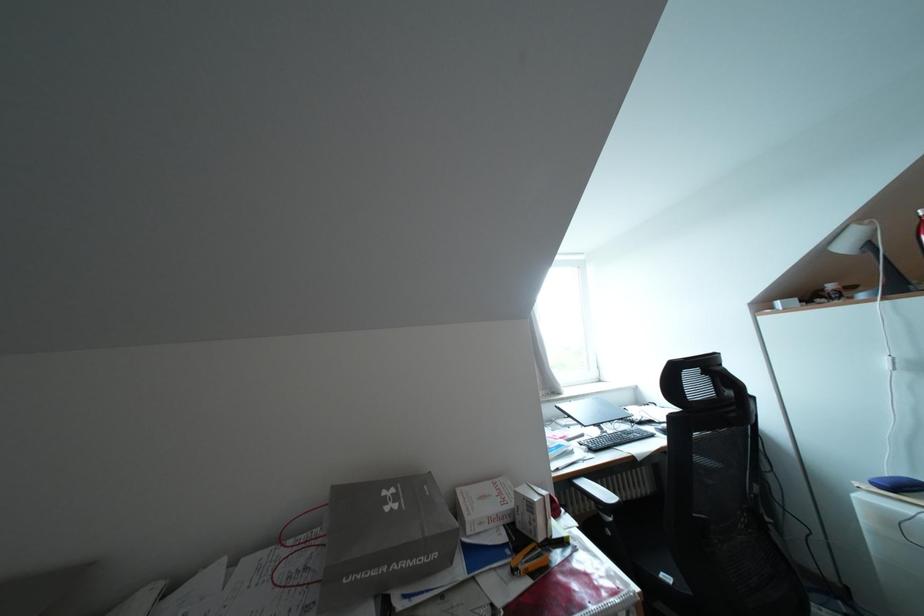
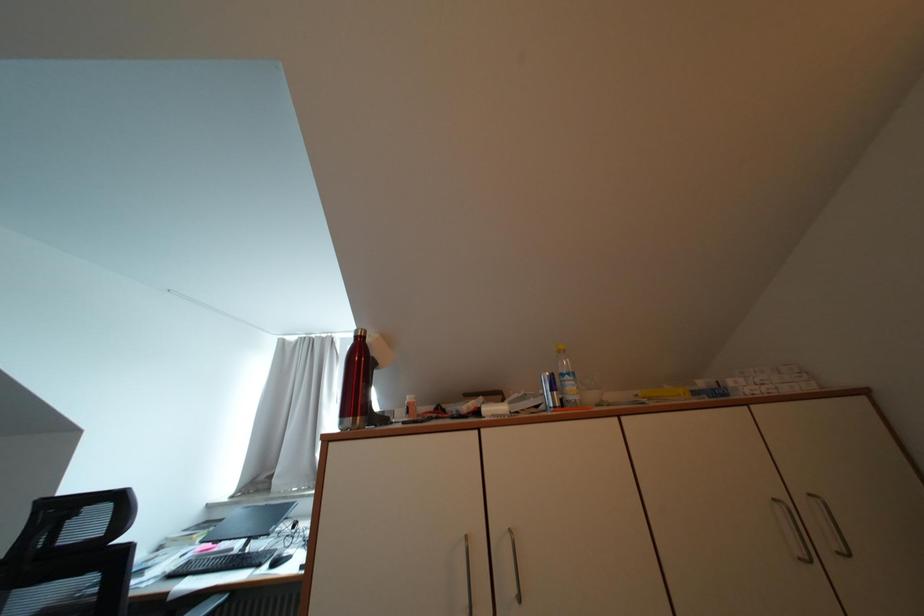
Question: What movement of the cameraman would produce the second image?

Choices:
 (A) Left
 (B) Right
 (C) Forward
 (D) Backward

Answer: (B)